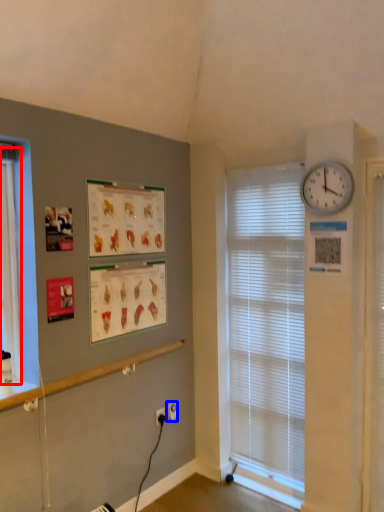
Question: Which object appears farthest to the camera in this image, bay window (highlighted by a red box) or electric outlet (highlighted by a blue box)?

Choices:
 (A) bay window
 (B) electric outlet

Answer: (B)